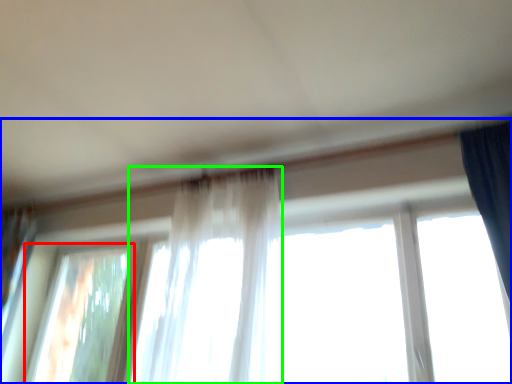
Question: Which is farther away from window (highlighted by a red box)? window (highlighted by a blue box) or curtain (highlighted by a green box)?

Choices:
 (A) window
 (B) curtain

Answer: (B)